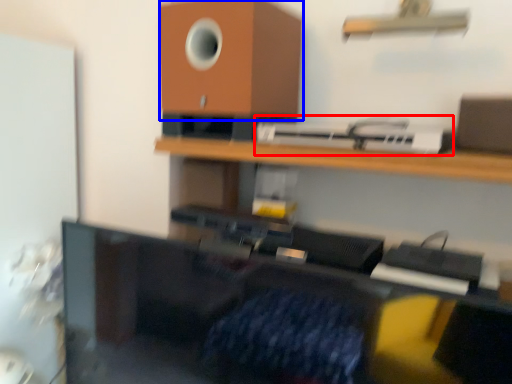
Question: Which object is closer to the camera taking this photo, printer (highlighted by a red box) or speaker (highlighted by a blue box)?

Choices:
 (A) printer
 (B) speaker

Answer: (A)